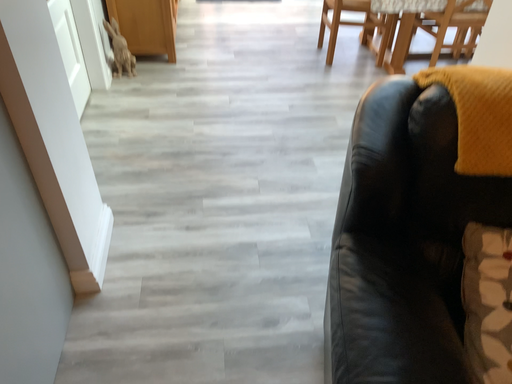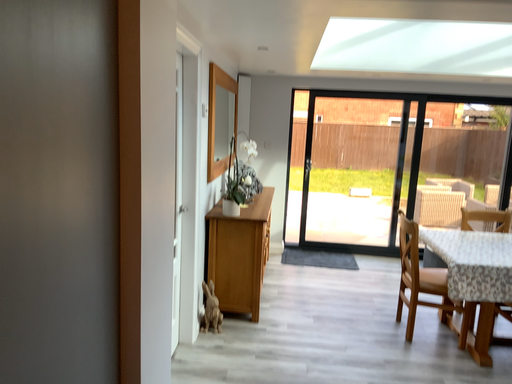
Question: Which way did the camera rotate in the video?

Choices:
 (A) rotated left
 (B) rotated right

Answer: (A)